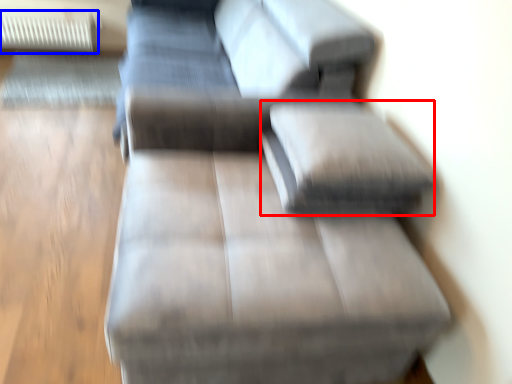
Question: Which point is further to the camera, pillow (highlighted by a red box) or radiator (highlighted by a blue box)?

Choices:
 (A) pillow
 (B) radiator

Answer: (B)